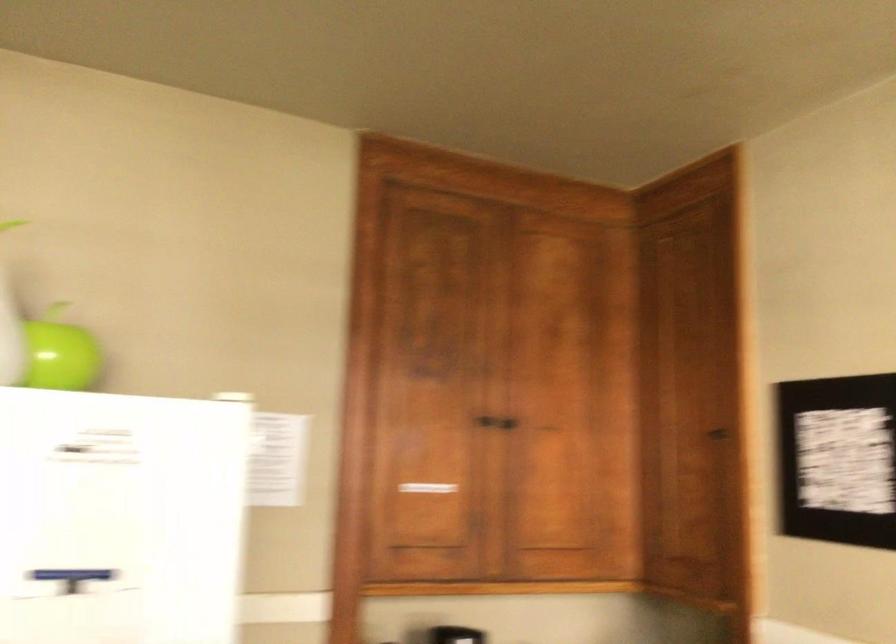
Image resolution: width=896 pixels, height=644 pixels. Identify the location of blue dispenser lever. (72, 574).